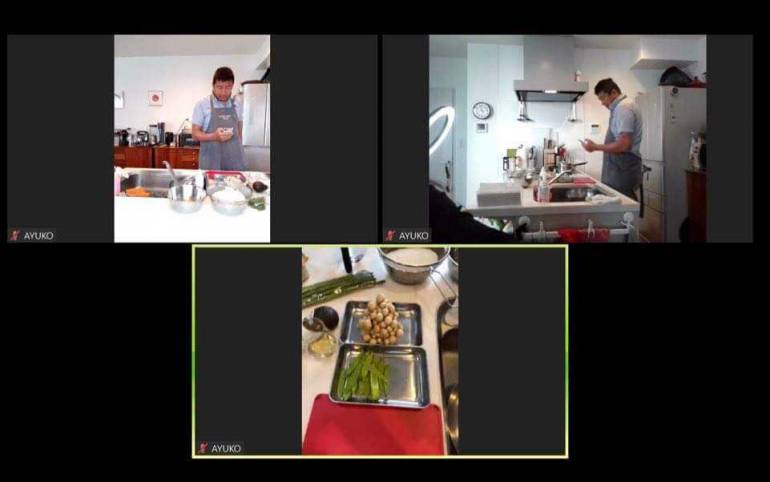
Identify the location of kitchen countertop. The height and width of the screenshot is (482, 770). (186, 225), (564, 209), (392, 288).